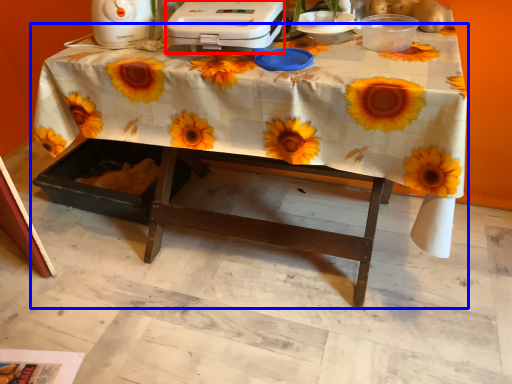
Question: Which object appears closest to the camera in this image, appliance (highlighted by a red box) or table (highlighted by a blue box)?

Choices:
 (A) appliance
 (B) table

Answer: (B)